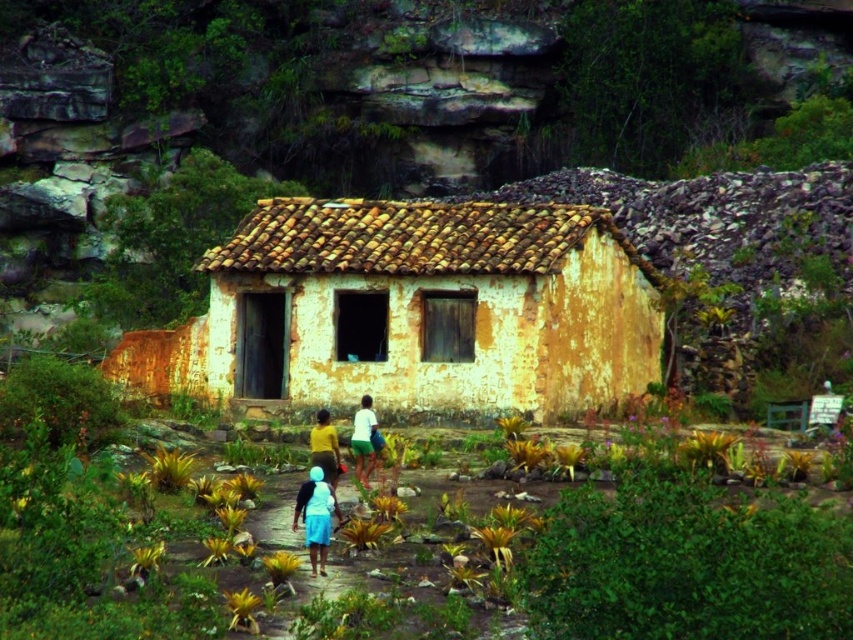
You are standing at point A and want to walk to the house. There are two points marked in the image, point A at coordinates point (x=456, y=205) and point B at coordinates point (x=360, y=460). Which point is closer to the house?

Point B at coordinates point (x=360, y=460) is closer to the house because point A at coordinates point (x=456, y=205) is behind point B, meaning it is farther away from the house.

You are standing in front of the yellowish weathered wood hut at center and the white matte shirt at center. Which object is closer to you?

The yellowish weathered wood hut at center is closer to you because the white matte shirt at center is behind it.

You are a fashion designer observing a model wearing a white matte skirt at center and a white matte shirt at center. Which clothing item has a greater width measurement?

The white matte skirt at center has a greater width than the white matte shirt at center according to the description.